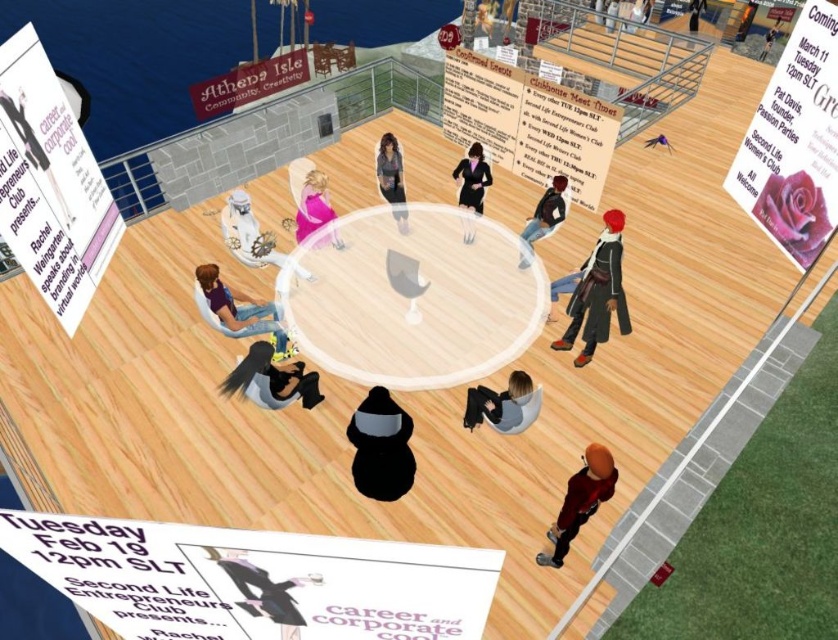
Is point (265, 387) positioned after point (328, 209)?

No.

Does black hair at lower center have a lesser height compared to matte pink dress at center?

Correct, black hair at lower center is not as tall as matte pink dress at center.

What do you see at coordinates (272, 380) in the screenshot?
I see `black hair at lower center` at bounding box center [272, 380].

You are a GUI agent. You are given a task and a screenshot of the screen. Output one action in this format:
    pyautogui.click(x=<x>, y=<y>)
    Task: Click on the black hair at lower center
    
    Given the screenshot: What is the action you would take?
    pyautogui.click(x=272, y=380)

Which is behind, point (313, 388) or point (249, 563)?

Positioned behind is point (313, 388).

Between black hair at lower center and black fabric dress at lower left, which one has less height?

Standing shorter between the two is black fabric dress at lower left.

Which is in front, point (256, 364) or point (260, 612)?

Point (260, 612)

Where is `black hair at lower center`? The width and height of the screenshot is (838, 640). black hair at lower center is located at coordinates (272, 380).

Measure the distance between matte black dress at center and denim jeans at lower right.

matte black dress at center and denim jeans at lower right are 1.86 meters apart.

Can you confirm if matte black dress at center is shorter than denim jeans at lower right?

No.

Find the location of `matte black dress at center`. matte black dress at center is located at coordinates (391, 177).

This screenshot has width=838, height=640. What are the coordinates of `matte black dress at center` in the screenshot? It's located at (391, 177).